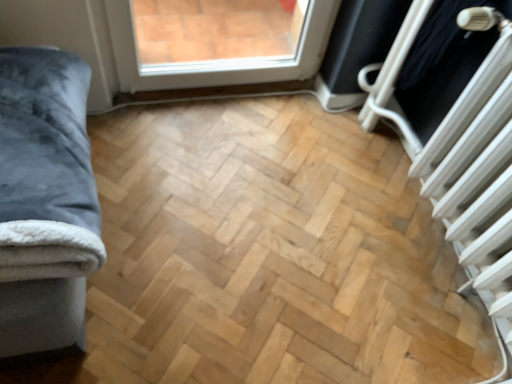
Image resolution: width=512 pixels, height=384 pixels. In order to click on vacant space situated on the left part of white metallic radiator at right in this screenshot , I will do `click(351, 240)`.